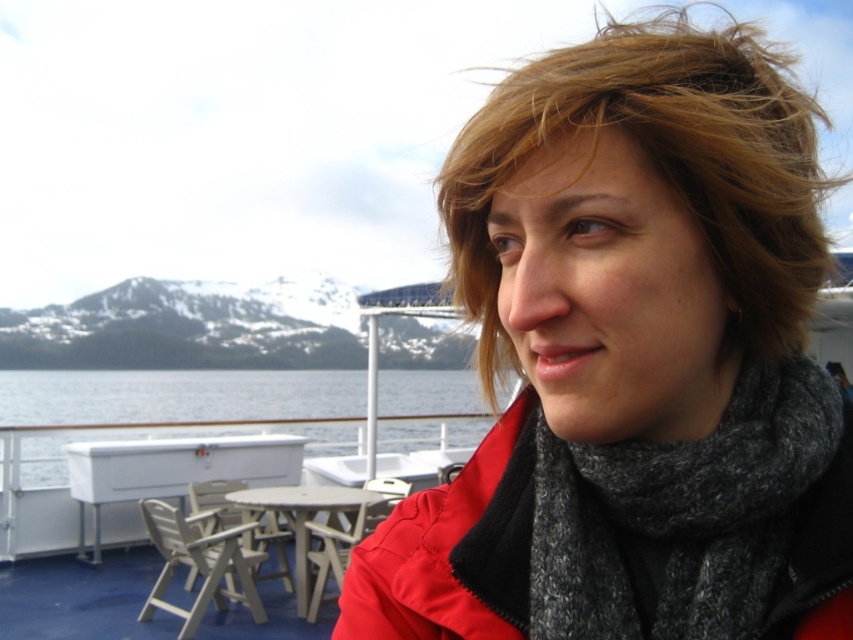
Question: Which object is positioned farthest from the matte red jacket at center?

Choices:
 (A) clear water at lower left
 (B) gray woolen scarf at right

Answer: (A)

Question: Which of these objects is positioned closest to the clear water at lower left?

Choices:
 (A) gray woolen scarf at right
 (B) matte red jacket at center

Answer: (B)

Question: Which point is closer to the camera?

Choices:
 (A) clear water at lower left
 (B) matte red jacket at center

Answer: (B)

Question: Is matte red jacket at center to the right of gray woolen scarf at right from the viewer's perspective?

Choices:
 (A) yes
 (B) no

Answer: (B)

Question: Does gray woolen scarf at right come behind clear water at lower left?

Choices:
 (A) yes
 (B) no

Answer: (B)

Question: Does matte red jacket at center have a greater width compared to clear water at lower left?

Choices:
 (A) yes
 (B) no

Answer: (B)